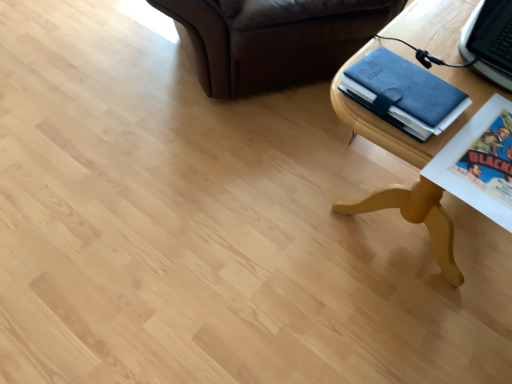
Question: Considering the relative sizes of wooden table at lower right and blue leather binder at upper right in the image provided, is wooden table at lower right thinner than blue leather binder at upper right?

Choices:
 (A) no
 (B) yes

Answer: (A)

Question: Considering the relative sizes of wooden table at lower right and blue leather binder at upper right in the image provided, is wooden table at lower right smaller than blue leather binder at upper right?

Choices:
 (A) yes
 (B) no

Answer: (B)

Question: Is wooden table at lower right wider than blue leather binder at upper right?

Choices:
 (A) no
 (B) yes

Answer: (B)

Question: Is wooden table at lower right beside blue leather binder at upper right?

Choices:
 (A) yes
 (B) no

Answer: (A)

Question: From the image's perspective, is wooden table at lower right beneath blue leather binder at upper right?

Choices:
 (A) no
 (B) yes

Answer: (A)

Question: Would you say blue leather binder at upper right is part of wooden table at lower right's contents?

Choices:
 (A) no
 (B) yes

Answer: (A)

Question: Can you confirm if blue leather binder at upper right is shorter than wooden table at lower right?

Choices:
 (A) no
 (B) yes

Answer: (B)

Question: From a real-world perspective, is blue leather binder at upper right below wooden table at lower right?

Choices:
 (A) yes
 (B) no

Answer: (B)

Question: Is blue leather binder at upper right to the left of wooden table at lower right from the viewer's perspective?

Choices:
 (A) no
 (B) yes

Answer: (B)

Question: Can you confirm if blue leather binder at upper right is smaller than wooden table at lower right?

Choices:
 (A) yes
 (B) no

Answer: (A)

Question: Could wooden table at lower right be considered to be inside blue leather binder at upper right?

Choices:
 (A) yes
 (B) no

Answer: (B)

Question: Is blue leather binder at upper right taller than wooden table at lower right?

Choices:
 (A) no
 (B) yes

Answer: (A)

Question: Based on their positions, is wooden table at lower right located to the left or right of blue leather binder at upper right?

Choices:
 (A) right
 (B) left

Answer: (A)